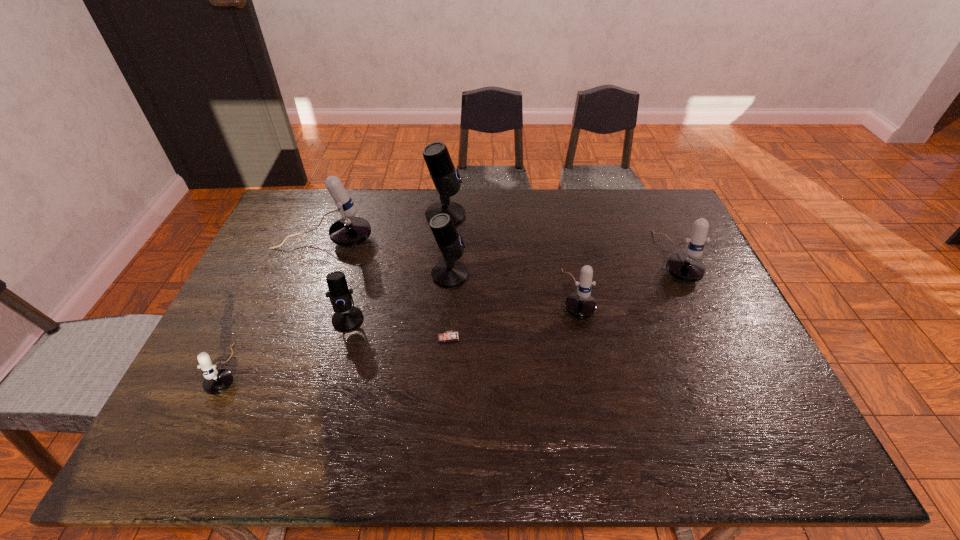
Where is `the farthest black microphone`? The width and height of the screenshot is (960, 540). the farthest black microphone is located at coordinates (445, 177).

The image size is (960, 540). Identify the location of the farthest object. (445, 177).

Find the location of a particular element. the biggest white microphone is located at coordinates pyautogui.click(x=350, y=230).

This screenshot has width=960, height=540. I want to click on the second biggest black microphone, so click(x=450, y=273).

Locate an element on the screen. This screenshot has height=540, width=960. the rightmost white microphone is located at coordinates (687, 267).

At what (x,y) coordinates should I click in order to perform the action: click on the third smallest white microphone. Please return your answer as a coordinate pair (x, y). The image size is (960, 540). Looking at the image, I should click on (687, 267).

At what (x,y) coordinates should I click in order to perform the action: click on the seventh object from left to right. Please return your answer as a coordinate pair (x, y). Looking at the image, I should click on (580, 304).

Find the location of a particular element. This screenshot has height=540, width=960. the sixth microphone from left to right is located at coordinates (580, 304).

The width and height of the screenshot is (960, 540). Identify the location of the smallest black microphone. (346, 317).

Where is `the nearest black microphone`? Image resolution: width=960 pixels, height=540 pixels. the nearest black microphone is located at coordinates (346, 317).